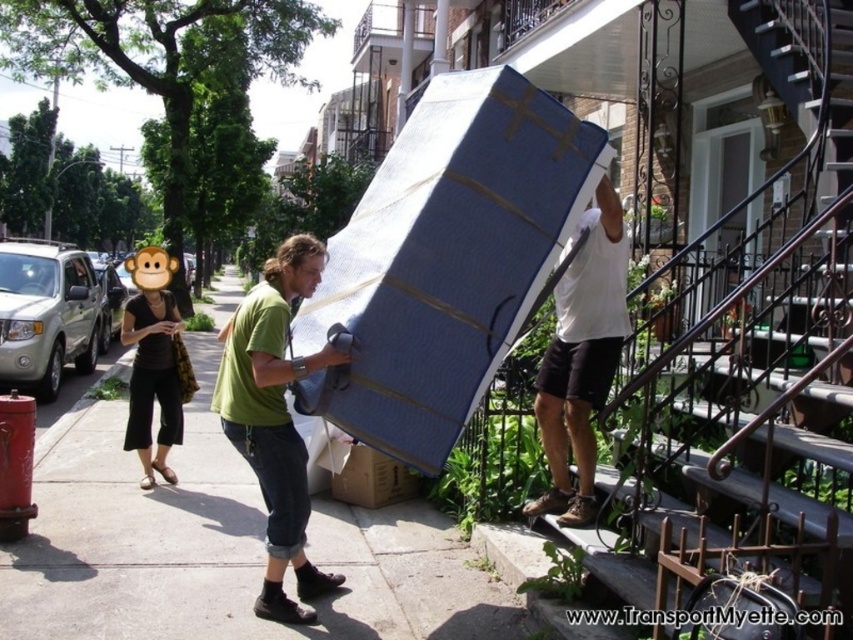
Question: Among these points, which one is farthest from the camera?

Choices:
 (A) (144, 474)
 (B) (335, 486)
 (C) (415, 500)

Answer: (A)

Question: Which point appears closest to the camera in this image?

Choices:
 (A) (155, 387)
 (B) (207, 461)
 (C) (619, 349)

Answer: (C)

Question: Can you confirm if white matte mattress at upper right is positioned to the left of brown fabric purse at lower left?

Choices:
 (A) yes
 (B) no

Answer: (B)

Question: Can you confirm if smooth concrete sidewalk at center is smaller than brown fabric purse at lower left?

Choices:
 (A) yes
 (B) no

Answer: (B)

Question: Does smooth concrete sidewalk at center appear over cardboard box at lower center?

Choices:
 (A) yes
 (B) no

Answer: (A)

Question: Among these points, which one is farthest from the camera?

Choices:
 (A) (352, 451)
 (B) (554, 452)

Answer: (A)